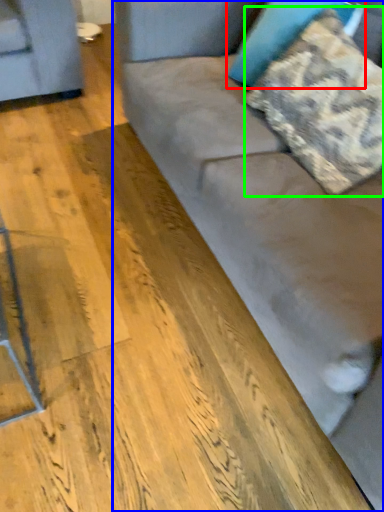
Question: Based on their relative distances, which object is nearer to pillow (highlighted by a red box)? Choose from studio couch (highlighted by a blue box) and pillow (highlighted by a green box).

Choices:
 (A) studio couch
 (B) pillow

Answer: (B)